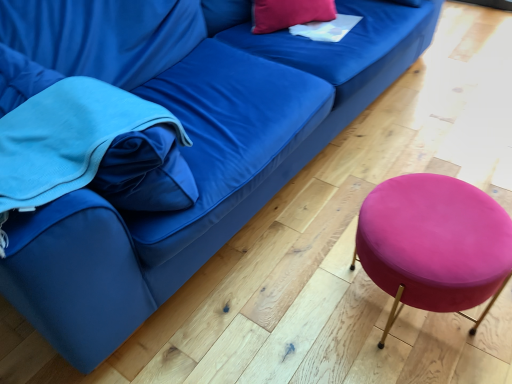
Locate an element on the screen. matte pink pillow at upper center is located at coordinates (290, 14).

Describe the element at coordinates (290, 14) in the screenshot. The height and width of the screenshot is (384, 512). I see `matte pink pillow at upper center` at that location.

What do you see at coordinates (434, 244) in the screenshot? The image size is (512, 384). I see `velvet pink stool at lower right` at bounding box center [434, 244].

Where is `velvet pink stool at lower right`? The width and height of the screenshot is (512, 384). velvet pink stool at lower right is located at coordinates (434, 244).

In order to click on matte pink pillow at upper center in this screenshot , I will do `click(290, 14)`.

Is matte pink pillow at upper center to the left or to the right of velvet pink stool at lower right in the image?

In the image, matte pink pillow at upper center appears on the left side of velvet pink stool at lower right.

Who is more distant, matte pink pillow at upper center or velvet pink stool at lower right?

matte pink pillow at upper center is behind.

Which point is more forward, (269, 15) or (406, 246)?

The point (406, 246) is in front.

From the image's perspective, which is above, matte pink pillow at upper center or velvet pink stool at lower right?

From the image's view, matte pink pillow at upper center is above.

From a real-world perspective, is matte pink pillow at upper center on top of velvet pink stool at lower right?

Yes.

In terms of width, does matte pink pillow at upper center look wider or thinner when compared to velvet pink stool at lower right?

Clearly, matte pink pillow at upper center has less width compared to velvet pink stool at lower right.

Does matte pink pillow at upper center have a greater height compared to velvet pink stool at lower right?

No.

Based on their sizes in the image, would you say matte pink pillow at upper center is bigger or smaller than velvet pink stool at lower right?

Clearly, matte pink pillow at upper center is smaller in size than velvet pink stool at lower right.

Is matte pink pillow at upper center located outside velvet pink stool at lower right?

Yes.

Is the surface of matte pink pillow at upper center in direct contact with velvet pink stool at lower right?

matte pink pillow at upper center is not next to velvet pink stool at lower right, and they're not touching.

Could you tell me if matte pink pillow at upper center is turned towards velvet pink stool at lower right?

No.

How different are the orientations of matte pink pillow at upper center and velvet pink stool at lower right in degrees?

22.1 degrees.

At what (x,y) coordinates should I click in order to perform the action: click on pillow above the velvet pink stool at lower right (from the image's perspective). Please return your answer as a coordinate pair (x, y). This screenshot has height=384, width=512. Looking at the image, I should click on (290, 14).

Does velvet pink stool at lower right appear on the right side of matte pink pillow at upper center?

Yes.

From the picture: Which object is further away from the camera taking this photo, velvet pink stool at lower right or matte pink pillow at upper center?

matte pink pillow at upper center.

Is point (452, 297) positioned behind point (308, 11)?

That is False.

From the image's perspective, is velvet pink stool at lower right below matte pink pillow at upper center?

Yes, from the image's perspective, velvet pink stool at lower right is below matte pink pillow at upper center.

From a real-world perspective, is velvet pink stool at lower right on matte pink pillow at upper center?

No.

Is velvet pink stool at lower right wider or thinner than matte pink pillow at upper center?

Considering their sizes, velvet pink stool at lower right looks broader than matte pink pillow at upper center.

Does velvet pink stool at lower right have a greater height compared to matte pink pillow at upper center?

Yes, velvet pink stool at lower right is taller than matte pink pillow at upper center.

Based on the photo, can you confirm if velvet pink stool at lower right is smaller than matte pink pillow at upper center?

No, velvet pink stool at lower right is not smaller than matte pink pillow at upper center.

Is velvet pink stool at lower right inside the boundaries of matte pink pillow at upper center, or outside?

velvet pink stool at lower right cannot be found inside matte pink pillow at upper center.

Are velvet pink stool at lower right and matte pink pillow at upper center far apart?

Yes.

Is velvet pink stool at lower right looking in the opposite direction of matte pink pillow at upper center?

That's not correct — velvet pink stool at lower right is not looking away from matte pink pillow at upper center.

How different are the orientations of velvet pink stool at lower right and matte pink pillow at upper center in degrees?

There is a 22.1-degree angle between the facing directions of velvet pink stool at lower right and matte pink pillow at upper center.

From the picture: Measure the distance between velvet pink stool at lower right and matte pink pillow at upper center.

The distance of velvet pink stool at lower right from matte pink pillow at upper center is 1.12 meters.

What are the coordinates of `bar stool that is in front of the matte pink pillow at upper center` in the screenshot? It's located at (434, 244).

Identify the location of bar stool located below the matte pink pillow at upper center (from the image's perspective). (434, 244).

The height and width of the screenshot is (384, 512). I want to click on pillow that is above the velvet pink stool at lower right (from the image's perspective), so click(x=290, y=14).